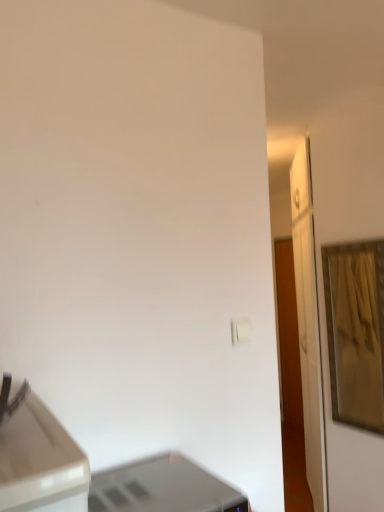
Where is `satin silver printer at lower center`? satin silver printer at lower center is located at coordinates (162, 488).

In order to face satin silver printer at lower center, should I rotate leftwards or rightwards?

To face it directly, rotate left by 4.852 degrees.

What do you see at coordinates (162, 488) in the screenshot? I see `satin silver printer at lower center` at bounding box center [162, 488].

Locate an element on the screen. gold metallic picture frame at right is located at coordinates (356, 332).

Describe the element at coordinates (356, 332) in the screenshot. I see `gold metallic picture frame at right` at that location.

Where is `satin silver printer at lower center`? This screenshot has height=512, width=384. satin silver printer at lower center is located at coordinates (162, 488).

Which object is positioned more to the right, gold metallic picture frame at right or satin silver printer at lower center?

Positioned to the right is gold metallic picture frame at right.

Relative to satin silver printer at lower center, is gold metallic picture frame at right in front or behind?

Visually, gold metallic picture frame at right is located behind satin silver printer at lower center.

Is point (377, 304) closer to camera compared to point (96, 481)?

No, it is behind (96, 481).

From the image's perspective, which is above, gold metallic picture frame at right or satin silver printer at lower center?

From the image's view, gold metallic picture frame at right is above.

From a real-world perspective, is gold metallic picture frame at right under satin silver printer at lower center?

No.

Is gold metallic picture frame at right wider or thinner than satin silver printer at lower center?

gold metallic picture frame at right is thinner than satin silver printer at lower center.

In terms of height, does gold metallic picture frame at right look taller or shorter compared to satin silver printer at lower center?

gold metallic picture frame at right is taller than satin silver printer at lower center.

Does gold metallic picture frame at right have a larger size compared to satin silver printer at lower center?

Correct, gold metallic picture frame at right is larger in size than satin silver printer at lower center.

Is gold metallic picture frame at right inside or outside of satin silver printer at lower center?

gold metallic picture frame at right exists outside the volume of satin silver printer at lower center.

Is gold metallic picture frame at right next to satin silver printer at lower center and touching it?

gold metallic picture frame at right and satin silver printer at lower center are clearly separated.

Does gold metallic picture frame at right turn towards satin silver printer at lower center?

Yes, gold metallic picture frame at right is aimed at satin silver printer at lower center.

Measure the distance between gold metallic picture frame at right and satin silver printer at lower center.

They are 3.13 meters apart.

Locate an element on the screen. This screenshot has width=384, height=512. printer located underneath the gold metallic picture frame at right (from a real-world perspective) is located at coordinates (162, 488).

Based on the photo, which is more to the left, satin silver printer at lower center or gold metallic picture frame at right?

satin silver printer at lower center is more to the left.

Between satin silver printer at lower center and gold metallic picture frame at right, which one is positioned in front?

satin silver printer at lower center is in front.

Considering the points (158, 458) and (355, 420), which point is in front, point (158, 458) or point (355, 420)?

The point (158, 458) is more forward.

From the image's perspective, would you say satin silver printer at lower center is shown under gold metallic picture frame at right?

Yes, from the image's perspective, satin silver printer at lower center is beneath gold metallic picture frame at right.

From a real-world perspective, is satin silver printer at lower center above or below gold metallic picture frame at right?

From a real-world perspective, satin silver printer at lower center is physically below gold metallic picture frame at right.

Considering the relative sizes of satin silver printer at lower center and gold metallic picture frame at right in the image provided, is satin silver printer at lower center thinner than gold metallic picture frame at right?

No, satin silver printer at lower center is not thinner than gold metallic picture frame at right.

Which of these two, satin silver printer at lower center or gold metallic picture frame at right, stands shorter?

satin silver printer at lower center.

Between satin silver printer at lower center and gold metallic picture frame at right, which one has larger size?

With larger size is gold metallic picture frame at right.

From the picture: Would you say satin silver printer at lower center is outside gold metallic picture frame at right?

Indeed, satin silver printer at lower center is completely outside gold metallic picture frame at right.

Would you consider satin silver printer at lower center to be distant from gold metallic picture frame at right?

satin silver printer at lower center is far away from gold metallic picture frame at right.

Is satin silver printer at lower center turned away from gold metallic picture frame at right?

satin silver printer at lower center is not turned away from gold metallic picture frame at right.

Can you tell me how much satin silver printer at lower center and gold metallic picture frame at right differ in facing direction?

There is a 89.4-degree angle between the facing directions of satin silver printer at lower center and gold metallic picture frame at right.

In the image, there is a satin silver printer at lower center. Where is `picture frame above it (from the image's perspective)`? The width and height of the screenshot is (384, 512). picture frame above it (from the image's perspective) is located at coordinates (356, 332).

Image resolution: width=384 pixels, height=512 pixels. In order to click on printer located on the left of gold metallic picture frame at right in this screenshot , I will do `click(162, 488)`.

The width and height of the screenshot is (384, 512). Identify the location of printer in front of the gold metallic picture frame at right. (162, 488).